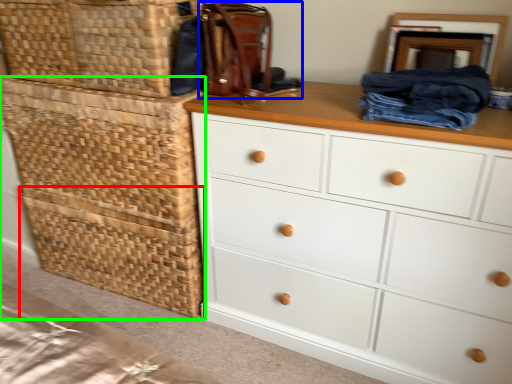
Question: Which is farther away from basket (highlighted by a red box)? handbag (highlighted by a blue box) or crate (highlighted by a green box)?

Choices:
 (A) handbag
 (B) crate

Answer: (A)